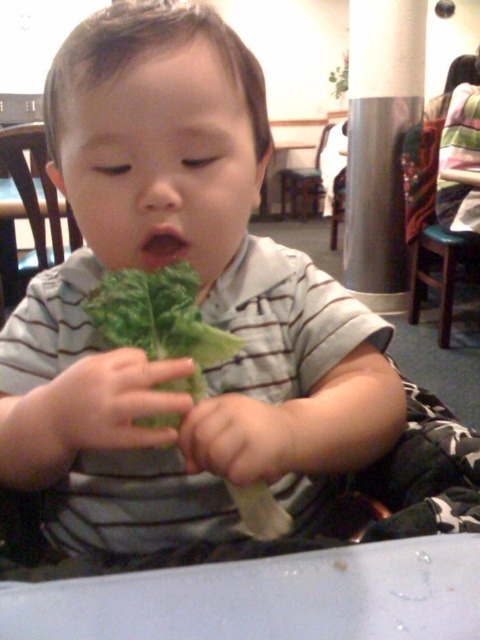
You are a robot navigating through a room. You need to move from the point at coordinates point (x=187, y=355) to the point at coordinates point (x=20, y=163). According to the scene description, which direction should you move?

Since point (x=187, y=355) is in front of point (x=20, y=163), you should move backward to reach the point at coordinates point (x=20, y=163).

You are a parent trying to decide where to place a new small plant in your dining area. You see the green leafy at center and the wooden chair at left. Which object is smaller and would be better suited for placing the plant next to?

The green leafy at center is smaller compared to the wooden chair at left, so placing the plant next to the green leafy at center would be better suited due to its smaller size.